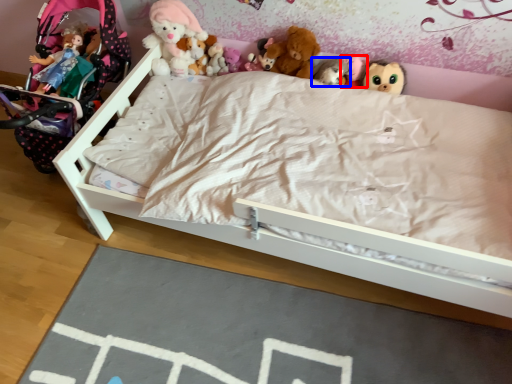
Question: Which point is further to the camera, toy (highlighted by a red box) or toy (highlighted by a blue box)?

Choices:
 (A) toy
 (B) toy

Answer: (A)